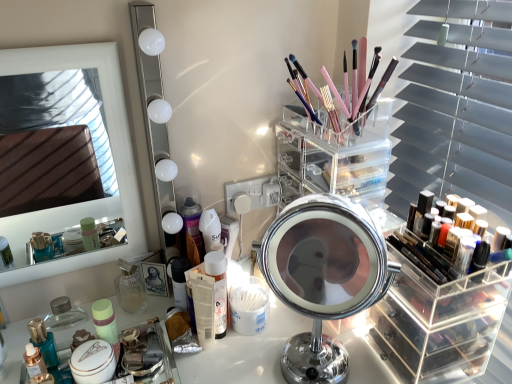
Find the location of a particular element. This screenshot has width=512, height=384. free spot to the left of matte black makeup artist at center is located at coordinates (90, 315).